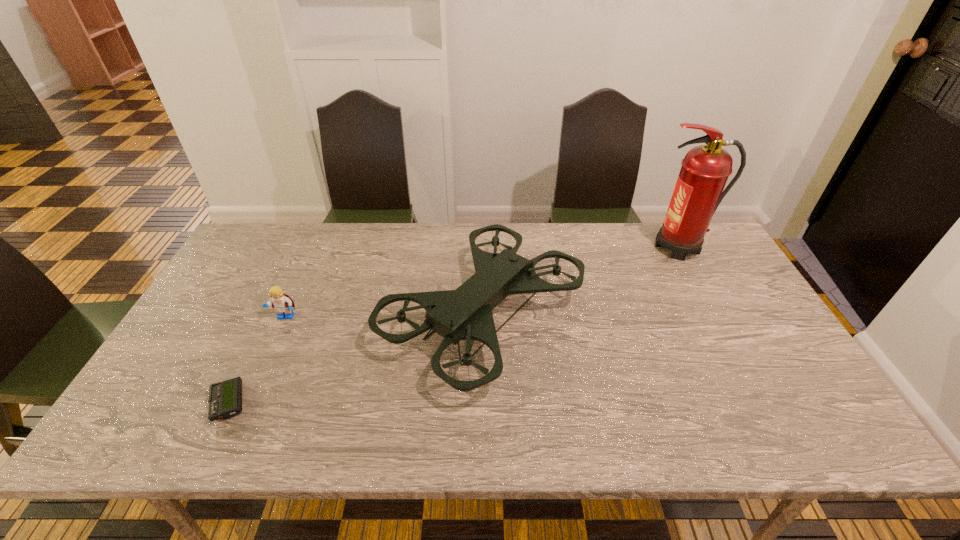
Locate an element on the screen. vacant space at the far edge is located at coordinates (419, 242).

In the image, there is a desktop. Identify the location of vacant area at the near edge. (367, 446).

Locate an element on the screen. The width and height of the screenshot is (960, 540). vacant space at the left edge of the desktop is located at coordinates (238, 341).

The image size is (960, 540). I want to click on vacant area at the right edge, so 723,272.

In order to click on free space between the Lego and the beeper in this screenshot , I will do `click(257, 360)`.

Locate an element on the screen. This screenshot has width=960, height=540. free area in between the shortest object and the Lego is located at coordinates (257, 360).

Where is `empty location between the beeper and the Lego`? This screenshot has width=960, height=540. empty location between the beeper and the Lego is located at coordinates (257, 360).

You are a GUI agent. You are given a task and a screenshot of the screen. Output one action in this format:
    pyautogui.click(x=<x>, y=<y>)
    Task: Click on the vacant area that lies between the drone and the beeper
    Image resolution: width=960 pixels, height=540 pixels.
    Given the screenshot: What is the action you would take?
    pyautogui.click(x=356, y=359)

Locate an element on the screen. The image size is (960, 540). empty space between the second shortest object and the shortest object is located at coordinates (257, 360).

The image size is (960, 540). Identify the location of object that is the second closest to the shortest object. (464, 314).